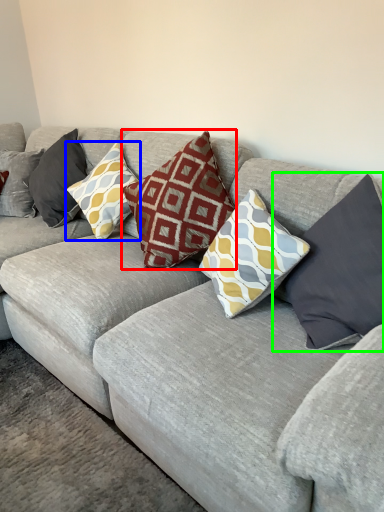
Question: Based on their relative distances, which object is farther from pillow (highlighted by a red box)? Choose from pillow (highlighted by a blue box) and pillow (highlighted by a green box).

Choices:
 (A) pillow
 (B) pillow

Answer: (B)